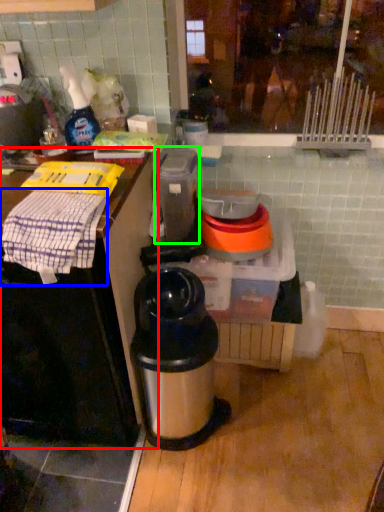
Question: Which object is the farthest from table (highlighted by a red box)? Choose among these: cloth (highlighted by a blue box) or appliance (highlighted by a green box).

Choices:
 (A) cloth
 (B) appliance

Answer: (B)